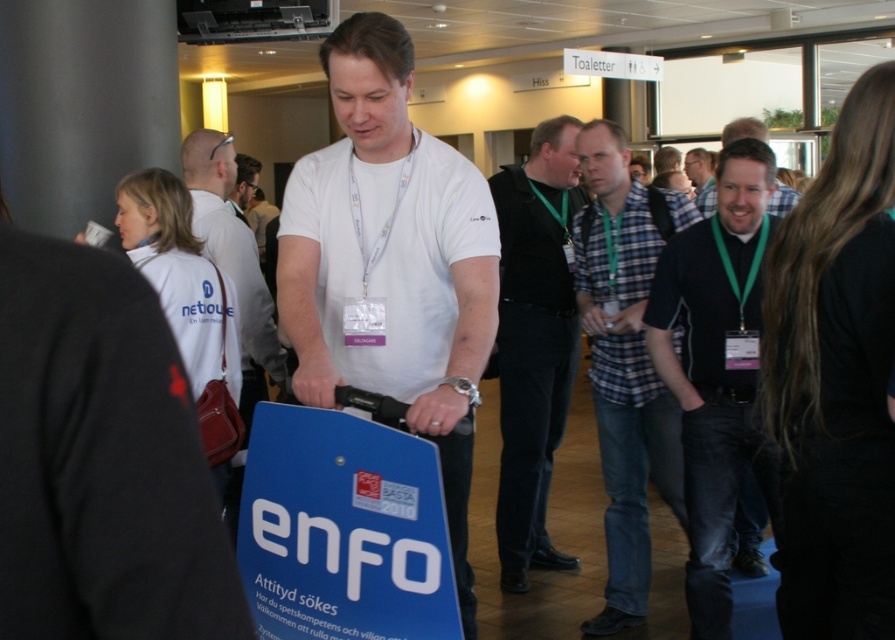
Who is shorter, plaid cotton shirt at center or black smooth vest at center?

With less height is plaid cotton shirt at center.

This screenshot has height=640, width=895. What do you see at coordinates (625, 362) in the screenshot?
I see `plaid cotton shirt at center` at bounding box center [625, 362].

Is point (612, 168) in front of point (501, 273)?

Yes, it is.

This screenshot has width=895, height=640. In order to click on plaid cotton shirt at center in this screenshot , I will do `click(625, 362)`.

Describe the element at coordinates (391, 262) in the screenshot. I see `white matte t-shirt at center` at that location.

Based on the photo, which of these two, white matte t-shirt at center or plaid cotton shirt at center, stands taller?

plaid cotton shirt at center is taller.

The width and height of the screenshot is (895, 640). Identify the location of white matte t-shirt at center. (391, 262).

Does white matte t-shirt at center have a lesser width compared to matte white shirt at center?

No, white matte t-shirt at center is not thinner than matte white shirt at center.

Is white matte t-shirt at center to the left of matte white shirt at center from the viewer's perspective?

In fact, white matte t-shirt at center is to the right of matte white shirt at center.

Is point (330, 376) positioned behind point (253, 179)?

No, (330, 376) is in front of (253, 179).

Where is `white matte t-shirt at center`? The height and width of the screenshot is (640, 895). white matte t-shirt at center is located at coordinates (391, 262).